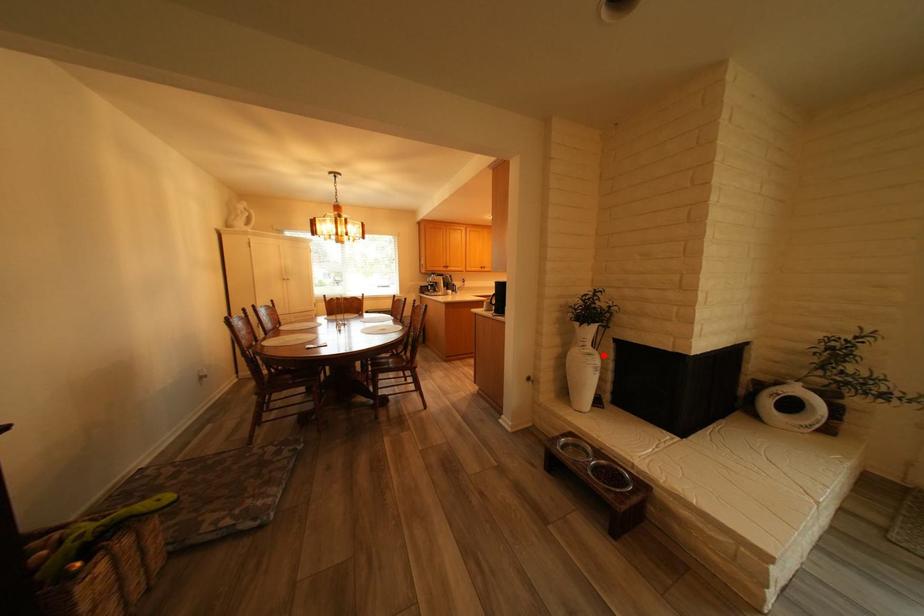
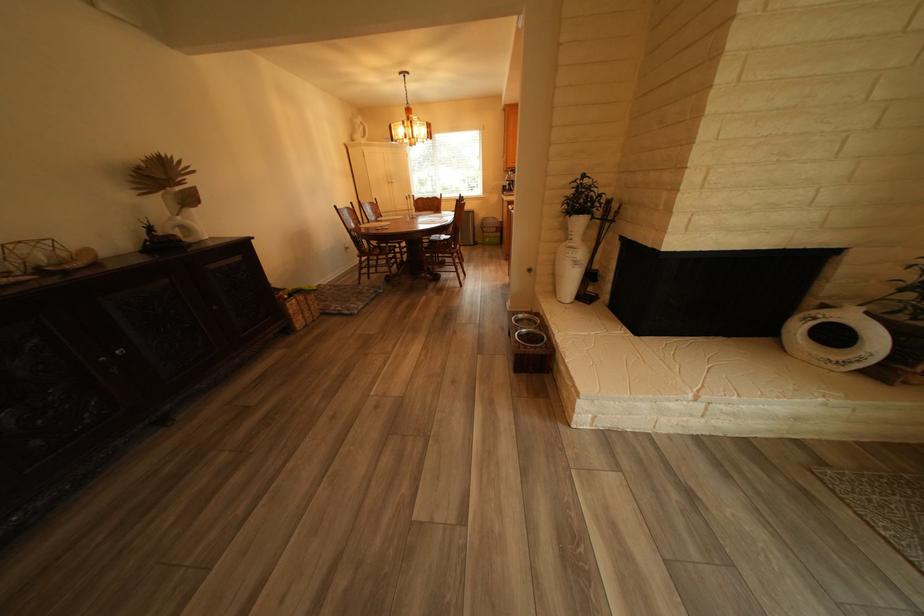
Question: I am providing you with two images of the same scene from different viewpoints. A red point is marked on the first image. Is the red point's position out of view in image 2?

Choices:
 (A) Yes
 (B) No

Answer: (B)